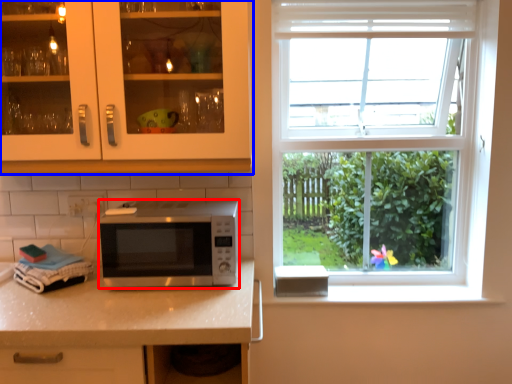
Question: Which object is further to the camera taking this photo, microwave oven (highlighted by a red box) or cabinetry (highlighted by a blue box)?

Choices:
 (A) microwave oven
 (B) cabinetry

Answer: (A)